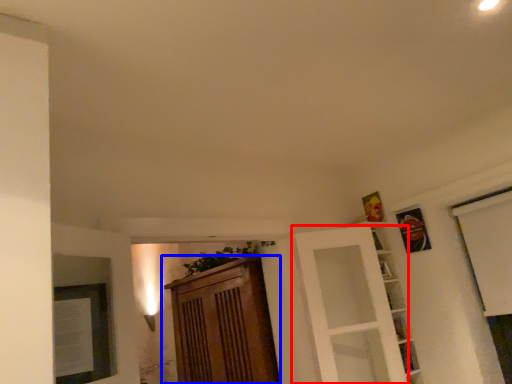
Question: Which object appears farthest to the camera in this image, door (highlighted by a red box) or cabinetry (highlighted by a blue box)?

Choices:
 (A) door
 (B) cabinetry

Answer: (B)